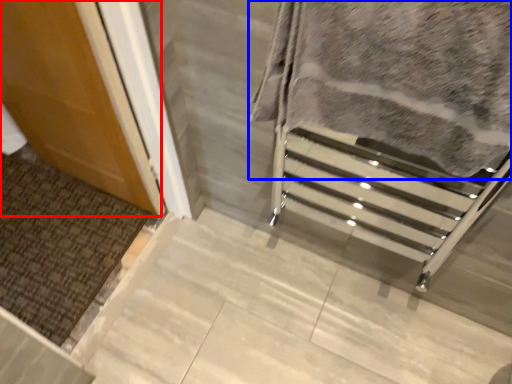
Question: Which of the following is the closest to the observer, door (highlighted by a red box) or blanket (highlighted by a blue box)?

Choices:
 (A) door
 (B) blanket

Answer: (B)